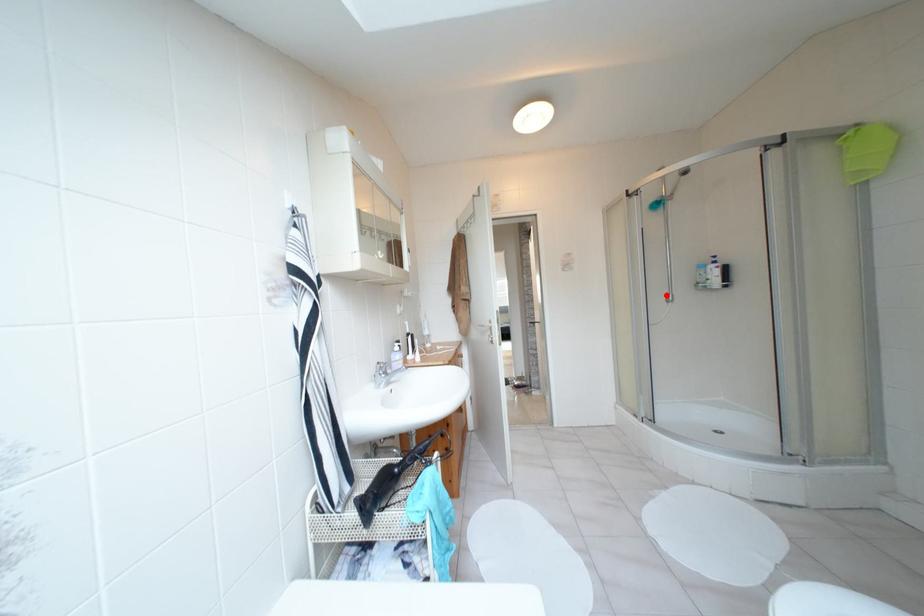
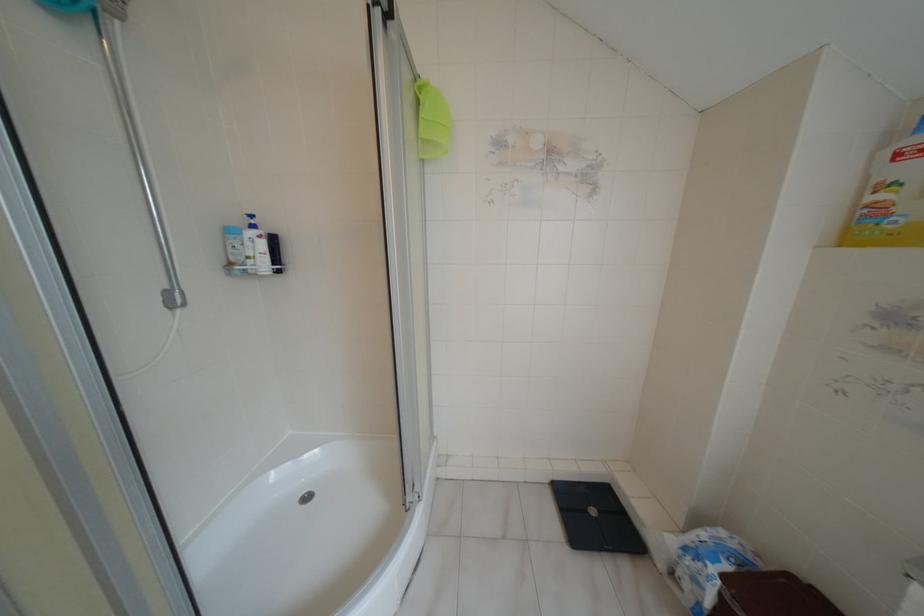
In the second image, find the point that corresponds to the highlighted location in the first image.

(166, 293)